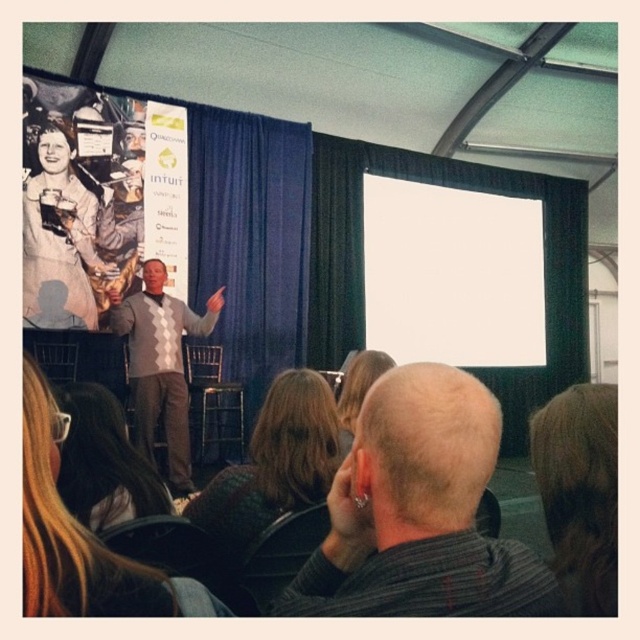
Question: Does blonde hair at center lie behind dark brown hair at lower left?

Choices:
 (A) yes
 (B) no

Answer: (B)

Question: Considering the relative positions of brown hair at upper right and dark brown hair at center in the image provided, where is brown hair at upper right located with respect to dark brown hair at center?

Choices:
 (A) above
 (B) below

Answer: (A)

Question: Does dark brown hair at center have a lesser width compared to dark brown hair at lower left?

Choices:
 (A) no
 (B) yes

Answer: (A)

Question: Which of the following is the closest to the observer?

Choices:
 (A) (220, 326)
 (B) (35, 406)
 (C) (358, 392)

Answer: (B)

Question: Which point is farther to the camera?

Choices:
 (A) dark brown hair at lower left
 (B) bald head at center

Answer: (B)

Question: Which object appears closest to the camera in this image?

Choices:
 (A) dark brown hair at lower left
 (B) blonde hair at center
 (C) knitted sweater at center

Answer: (B)